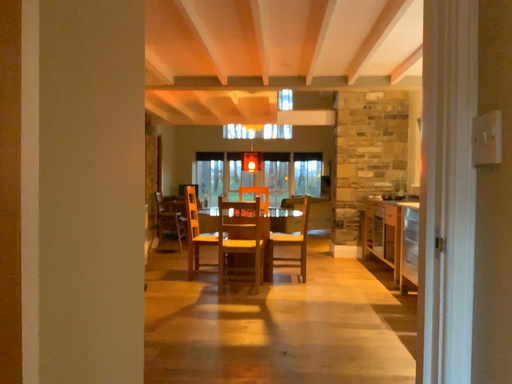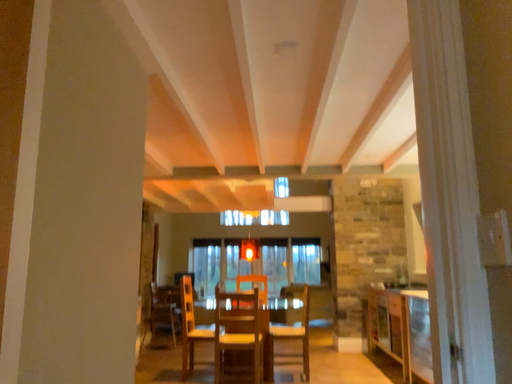
Question: Which way did the camera rotate in the video?

Choices:
 (A) rotated upward
 (B) rotated downward

Answer: (A)